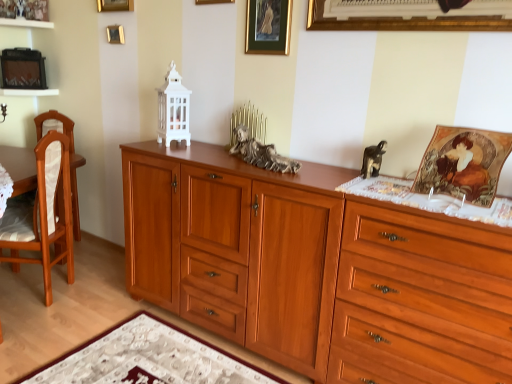
Find the location of `vacant space that is to the left of bronze statue at center, the second animal in the right-to-left sequence`. vacant space that is to the left of bronze statue at center, the second animal in the right-to-left sequence is located at coordinates (207, 160).